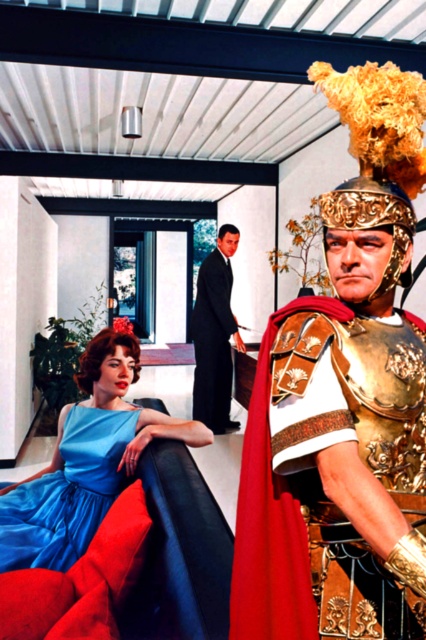
Is gold plated armor at center to the right of satin blue dress at lower left from the viewer's perspective?

Indeed, gold plated armor at center is positioned on the right side of satin blue dress at lower left.

I want to click on gold plated armor at center, so click(271, 516).

Can you confirm if satin blue dress at lower left is bigger than black suit at center?

No.

Is point (37, 524) farther from viewer compared to point (212, 394)?

No, (37, 524) is in front of (212, 394).

Is point (31, 545) behind point (216, 304)?

No, (31, 545) is closer to viewer.

At what (x,y) coordinates should I click in order to perform the action: click on satin blue dress at lower left. Please return your answer as a coordinate pair (x, y). Looking at the image, I should click on (66, 493).

Between gold plated armor at center and black suit at center, which one appears on the right side from the viewer's perspective?

Positioned to the right is gold plated armor at center.

Does point (275, 326) lie in front of point (203, 296)?

That is True.

Is point (268, 339) positioned before point (207, 396)?

Yes, it is.

At what (x,y) coordinates should I click in order to perform the action: click on gold plated armor at center. Please return your answer as a coordinate pair (x, y). Looking at the image, I should click on (271, 516).